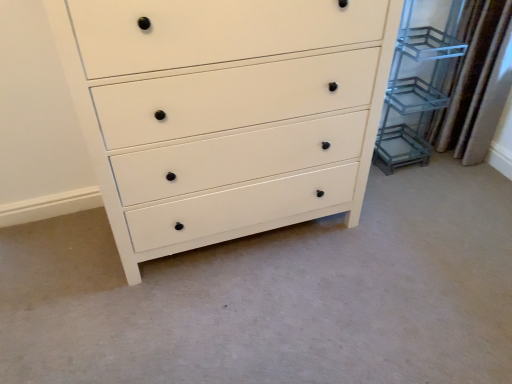
Question: From a real-world perspective, does white matte chest of drawers at center sit lower than brown textured curtain at right?

Choices:
 (A) no
 (B) yes

Answer: (A)

Question: Could you tell me if white matte chest of drawers at center is turned towards brown textured curtain at right?

Choices:
 (A) no
 (B) yes

Answer: (A)

Question: Is white matte chest of drawers at center not close to brown textured curtain at right?

Choices:
 (A) no
 (B) yes

Answer: (B)

Question: Is white matte chest of drawers at center closer to camera compared to brown textured curtain at right?

Choices:
 (A) yes
 (B) no

Answer: (A)

Question: Is brown textured curtain at right at the back of white matte chest of drawers at center?

Choices:
 (A) no
 (B) yes

Answer: (A)

Question: Is brown textured curtain at right inside white matte chest of drawers at center?

Choices:
 (A) yes
 (B) no

Answer: (B)

Question: Is white matte chest of drawers at center smaller than clear glass shelving unit at right?

Choices:
 (A) no
 (B) yes

Answer: (A)

Question: From a real-world perspective, does white matte chest of drawers at center sit lower than clear glass shelving unit at right?

Choices:
 (A) no
 (B) yes

Answer: (A)

Question: Can you confirm if white matte chest of drawers at center is wider than clear glass shelving unit at right?

Choices:
 (A) yes
 (B) no

Answer: (A)

Question: Can you confirm if white matte chest of drawers at center is positioned to the left of clear glass shelving unit at right?

Choices:
 (A) no
 (B) yes

Answer: (B)

Question: Can you confirm if white matte chest of drawers at center is shorter than clear glass shelving unit at right?

Choices:
 (A) yes
 (B) no

Answer: (B)

Question: Is white matte chest of drawers at center facing away from clear glass shelving unit at right?

Choices:
 (A) no
 (B) yes

Answer: (A)

Question: Does clear glass shelving unit at right appear on the right side of brown textured curtain at right?

Choices:
 (A) yes
 (B) no

Answer: (B)